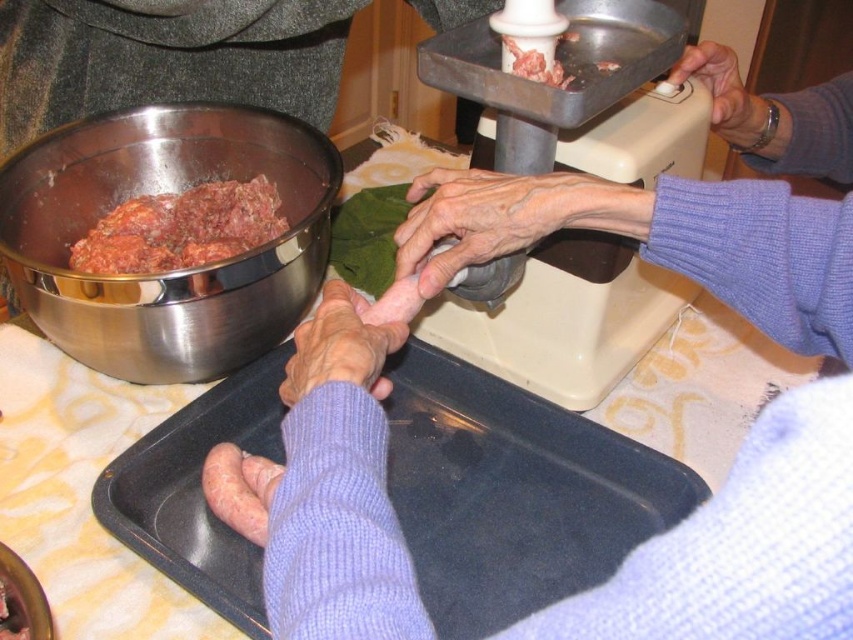
You are a chef observing the food preparation scene. You notice the metallic wristwatch at upper right and the pinkish smooth sausage at lower left. From your perspective, which object is positioned more to the east?

The metallic wristwatch at upper right is positioned more to the east than the pinkish smooth sausage at lower left because it is to the right of it.

You are standing at the point labeled point (x=724, y=96) and want to reach the point labeled point (x=312, y=244). Which direction should you move in to get there?

You should move forward because point (x=312, y=244) is in front of point (x=724, y=96).